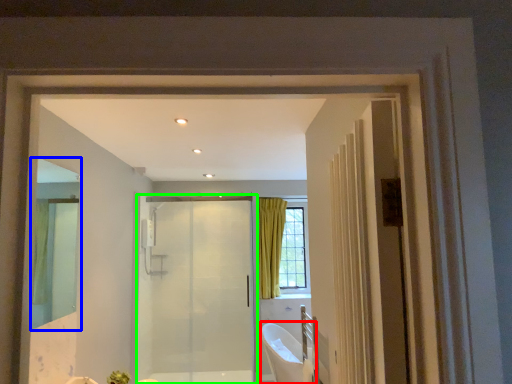
Question: Which is farther away from bath (highlighted by a red box)? mirror (highlighted by a blue box) or door (highlighted by a green box)?

Choices:
 (A) mirror
 (B) door

Answer: (A)